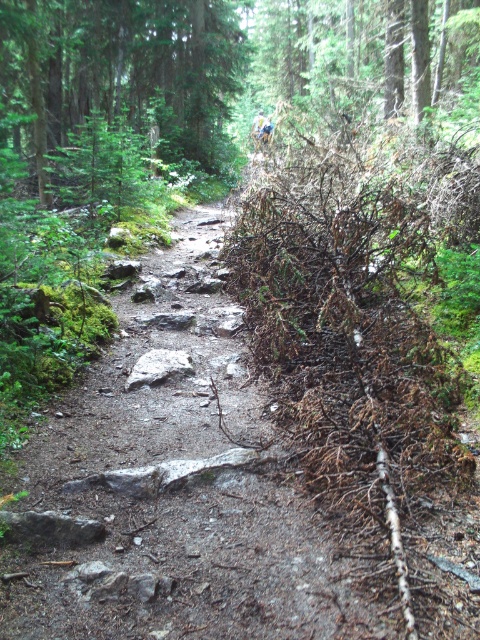
Question: Which point is farther from the camera taking this photo?

Choices:
 (A) (202, 129)
 (B) (249, 616)

Answer: (A)

Question: From the image, what is the correct spatial relationship of dirt path at center in relation to green matte tree at upper center?

Choices:
 (A) below
 (B) above

Answer: (A)

Question: Which object is farther from the camera taking this photo?

Choices:
 (A) dirt path at center
 (B) green matte tree at upper center

Answer: (B)

Question: Can you confirm if dirt path at center is wider than green matte tree at upper center?

Choices:
 (A) yes
 (B) no

Answer: (B)

Question: Is dirt path at center to the left of green matte tree at upper center from the viewer's perspective?

Choices:
 (A) no
 (B) yes

Answer: (A)

Question: Which of the following is the closest to the observer?

Choices:
 (A) (243, 465)
 (B) (80, 20)

Answer: (A)